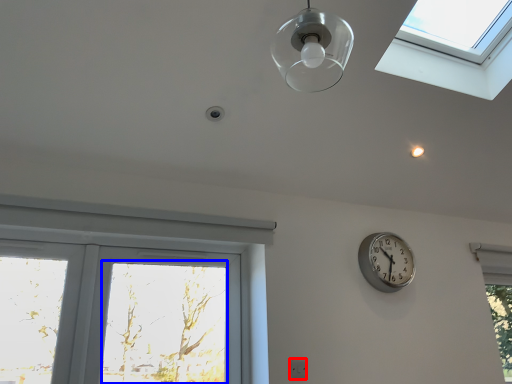
Question: Which point is closer to the camera, electric outlet (highlighted by a red box) or window screen (highlighted by a blue box)?

Choices:
 (A) electric outlet
 (B) window screen

Answer: (B)